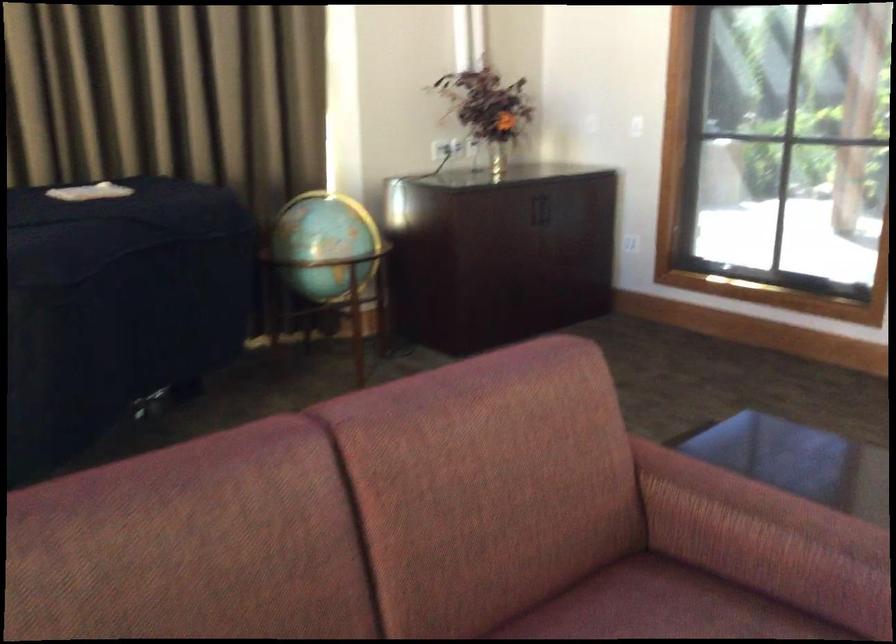
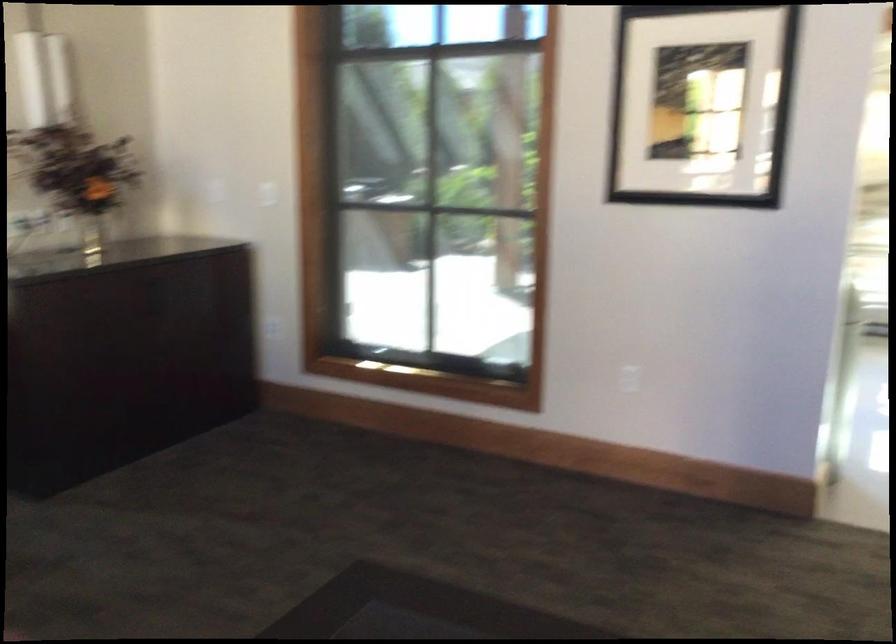
In a continuous first-person perspective shot, in which direction is the camera moving?

The movement direction of the cameraman is right, forward.